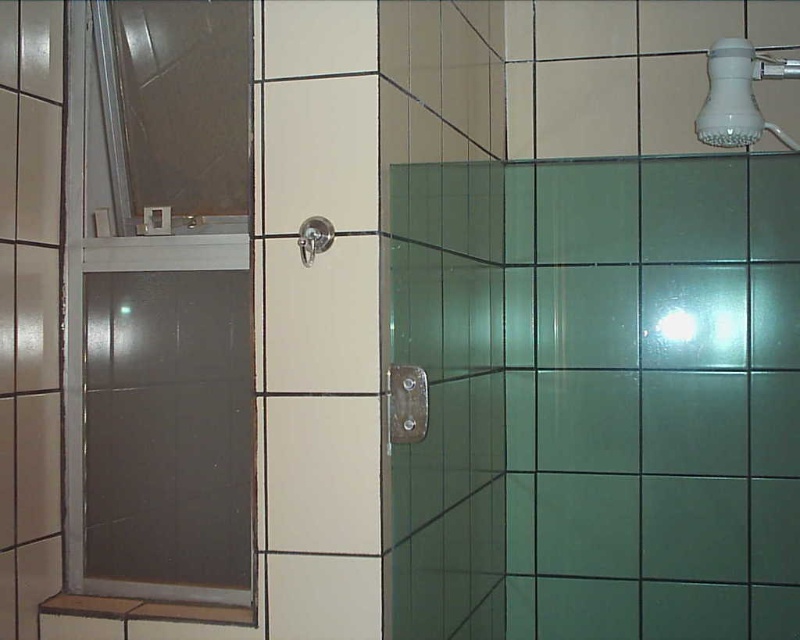
Question: Among these points, which one is farthest from the camera?

Choices:
 (A) (726, 125)
 (B) (300, 256)

Answer: (A)

Question: Can you confirm if frosted glass door at left is positioned below white plastic shower head at upper right?

Choices:
 (A) yes
 (B) no

Answer: (A)

Question: Which of the following is the closest to the observer?

Choices:
 (A) satin nickel showerhead at upper center
 (B) white plastic shower head at upper right
 (C) frosted glass door at left

Answer: (A)

Question: Can you confirm if white plastic shower head at upper right is bigger than satin nickel showerhead at upper center?

Choices:
 (A) no
 (B) yes

Answer: (B)

Question: Which point appears farthest from the camera in this image?

Choices:
 (A) (302, 230)
 (B) (710, 132)

Answer: (B)

Question: Does frosted glass door at left have a larger size compared to white plastic shower head at upper right?

Choices:
 (A) yes
 (B) no

Answer: (A)